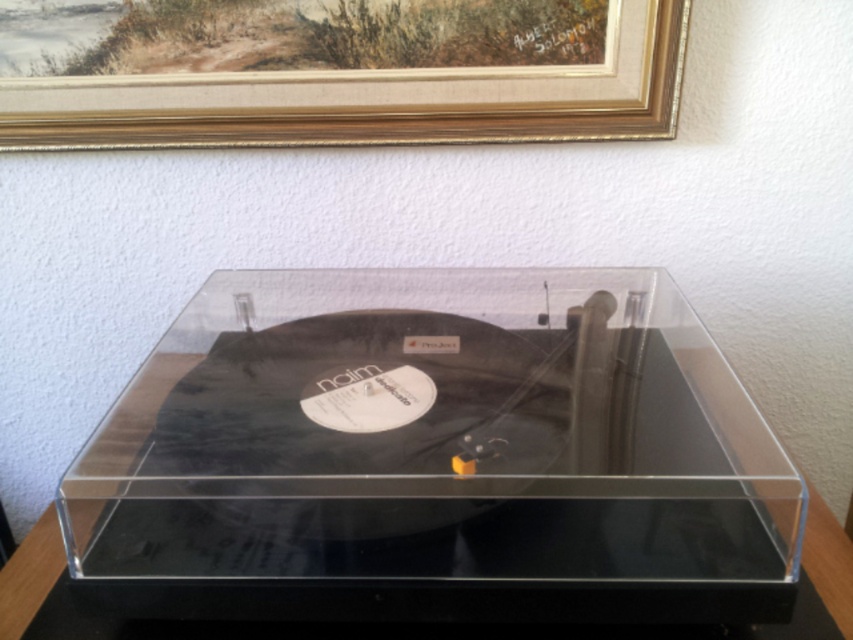
Question: Is transparent acrylic record player at center above gold wood picture frame at upper center?

Choices:
 (A) no
 (B) yes

Answer: (A)

Question: Which point appears closest to the camera in this image?

Choices:
 (A) (331, 17)
 (B) (231, 586)

Answer: (B)

Question: Does transparent acrylic record player at center have a larger size compared to gold wood picture frame at upper center?

Choices:
 (A) no
 (B) yes

Answer: (B)

Question: Does transparent acrylic record player at center have a smaller size compared to gold wood picture frame at upper center?

Choices:
 (A) no
 (B) yes

Answer: (A)